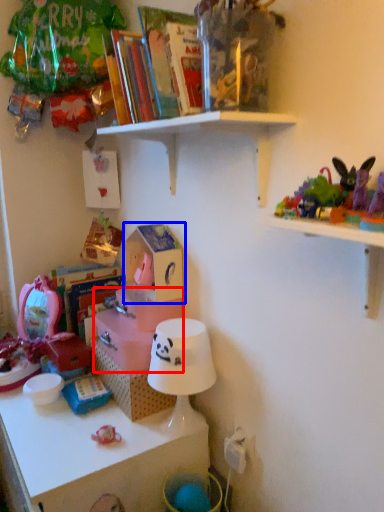
Question: Which point is closer to the camera, storage box (highlighted by a red box) or storage box (highlighted by a blue box)?

Choices:
 (A) storage box
 (B) storage box

Answer: (B)